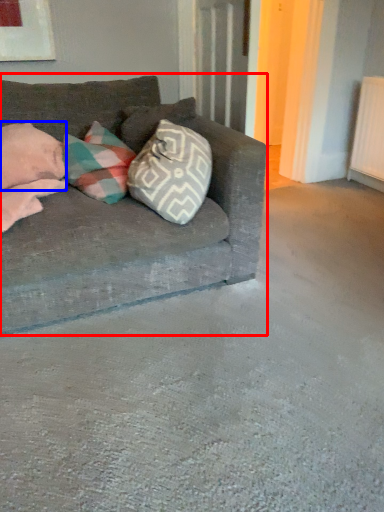
Question: Which object is closer to the camera taking this photo, studio couch (highlighted by a red box) or pillow (highlighted by a blue box)?

Choices:
 (A) studio couch
 (B) pillow

Answer: (A)